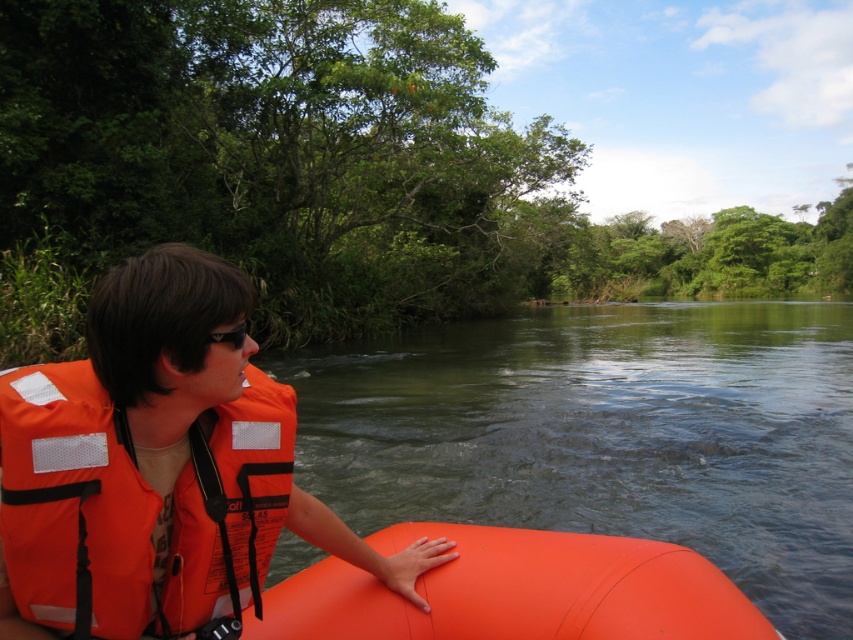
Consider the image. Can you confirm if orange rubber boat at center is positioned to the left of black plastic goggles at upper left?

In fact, orange rubber boat at center is to the right of black plastic goggles at upper left.

Is orange rubber boat at center taller than black plastic goggles at upper left?

Yes.

Does point (737, 588) come in front of point (225, 339)?

No, (737, 588) is further to viewer.

Image resolution: width=853 pixels, height=640 pixels. What are the coordinates of `orange rubber boat at center` in the screenshot? It's located at (515, 592).

Can you confirm if green smooth water at center is shorter than orange rubber boat at center?

Incorrect, green smooth water at center's height does not fall short of orange rubber boat at center's.

Can you confirm if green smooth water at center is wider than orange rubber boat at center?

Indeed, green smooth water at center has a greater width compared to orange rubber boat at center.

Image resolution: width=853 pixels, height=640 pixels. Find the location of `green smooth water at center`. green smooth water at center is located at coordinates (606, 435).

Where is `green smooth water at center`? Image resolution: width=853 pixels, height=640 pixels. green smooth water at center is located at coordinates (606, 435).

Between orange fabric life jacket at left and black plastic goggles at upper left, which one appears on the left side from the viewer's perspective?

orange fabric life jacket at left

Is point (80, 538) positioned after point (231, 342)?

No.

What are the coordinates of `orange fabric life jacket at left` in the screenshot? It's located at [73, 502].